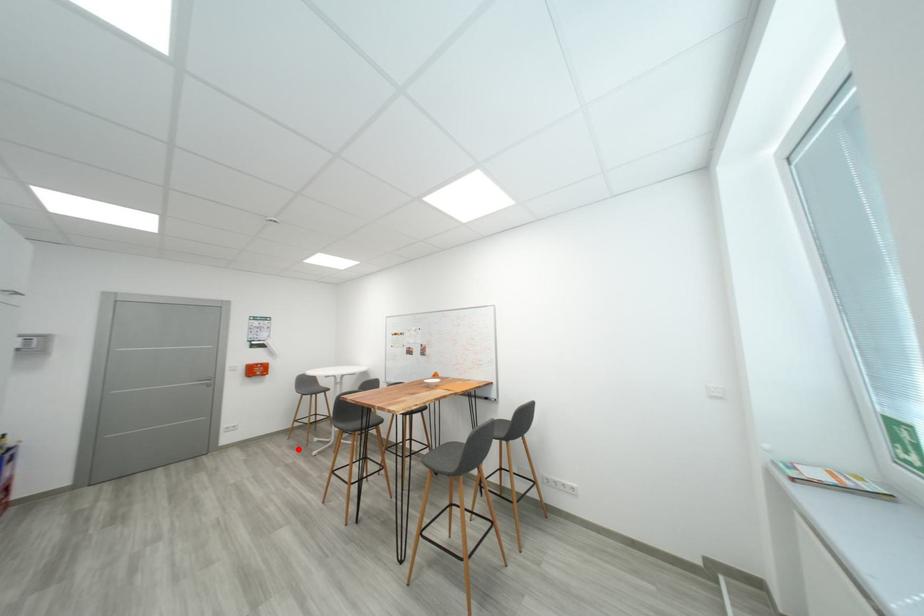
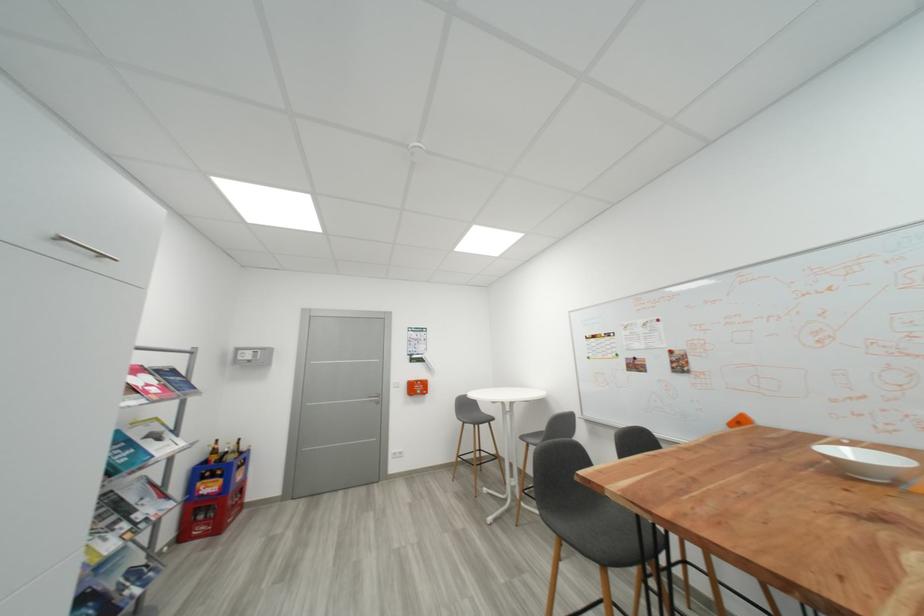
Question: I am providing you with two images of the same scene from different viewpoints. Image1 has a red point marked. In image2, the corresponding 3D location appears at what relative position? Reply with the corresponding letter.

Choices:
 (A) Closer
 (B) Farther

Answer: (B)